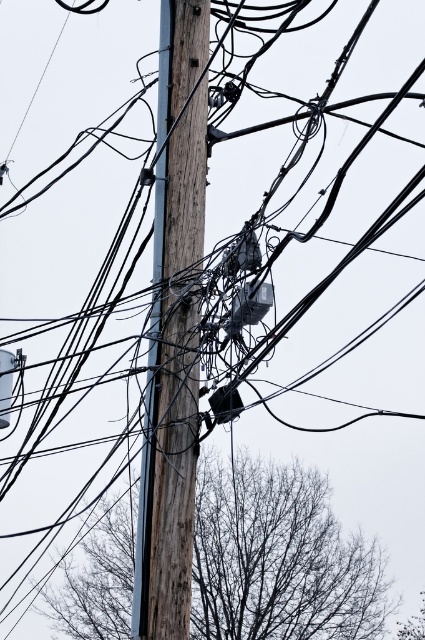
You are a bird looking for a place to perch. You see the bare branches at lower center and the wooden telegraph pole at center. Which is closer to you?

The bare branches at lower center are closer to you since they are only 65.53 feet away from the wooden telegraph pole at center, which is farther away.

You are a bird looking for a place to perch. You see the bare branches at lower center and the wooden telegraph pole at center. Which one is closer to the ground?

The bare branches at lower center are closer to the ground since they are positioned below the wooden telegraph pole at center.